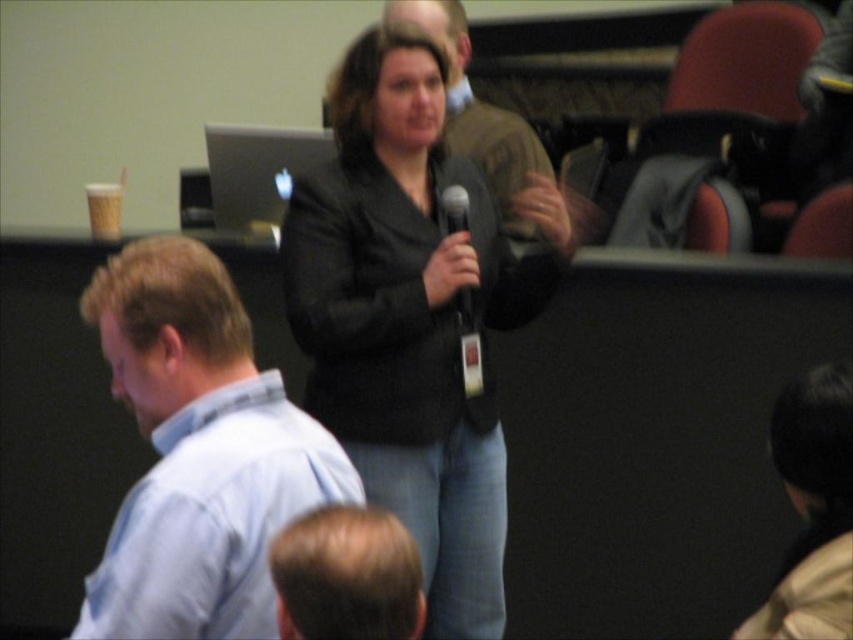
Which is below, light blue shirt at left or dark brown hair at lower right?

dark brown hair at lower right is lower down.

Measure the distance between light blue shirt at left and camera.

light blue shirt at left and camera are 3.70 feet apart.

This screenshot has height=640, width=853. I want to click on light blue shirt at left, so click(196, 452).

Is black matte jacket at center smaller than black matte microphone at center?

No.

In the scene shown: Who is lower down, black matte jacket at center or black matte microphone at center?

Positioned lower is black matte jacket at center.

Is point (350, 417) farther from viewer compared to point (466, 285)?

No, (350, 417) is closer to viewer.

You are a GUI agent. You are given a task and a screenshot of the screen. Output one action in this format:
    pyautogui.click(x=<x>, y=<y>)
    Task: Click on the black matte jacket at center
    This screenshot has width=853, height=640.
    Given the screenshot: What is the action you would take?
    pyautogui.click(x=412, y=316)

Who is more distant from viewer, (305, 561) or (462, 230)?

Point (462, 230)

Describe the element at coordinates (346, 577) in the screenshot. I see `blonde hair at lower center` at that location.

At what (x,y) coordinates should I click in order to perform the action: click on blonde hair at lower center. Please return your answer as a coordinate pair (x, y). Image resolution: width=853 pixels, height=640 pixels. Looking at the image, I should click on (346, 577).